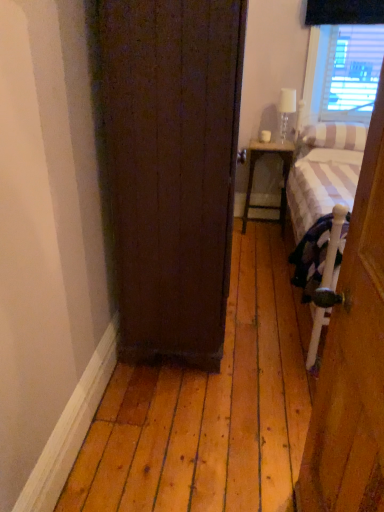
Question: Is white striped pillow at right, which is the second pillow in top-to-bottom order, in front of or behind wooden door at right, positioned as the 1th door in right-to-left order, in the image?

Choices:
 (A) front
 (B) behind

Answer: (B)

Question: Is point (342, 150) closer or farther from the camera than point (382, 323)?

Choices:
 (A) farther
 (B) closer

Answer: (A)

Question: Estimate the real-world distances between objects in this image. Which object is closer to the white striped pillow at right, which is the second pillow in top-to-bottom order?

Choices:
 (A) clear glass lamp at upper right
 (B) white striped pillow at right, the 1th pillow when ordered from top to bottom
 (C) matte white wood nightstand at center
 (D) dark wood door at center, arranged as the second door when viewed from the front
 (E) white striped fabric bed at right

Answer: (B)

Question: Which of these objects is positioned closest to the white striped pillow at right, which is the second pillow in top-to-bottom order?

Choices:
 (A) white striped pillow at right, the 1th pillow when ordered from top to bottom
 (B) wooden door at right, which appears as the 2th door when viewed from the left
 (C) dark wood door at center, arranged as the second door when viewed from the front
 (D) clear glass lamp at upper right
 (E) white striped fabric bed at right

Answer: (A)